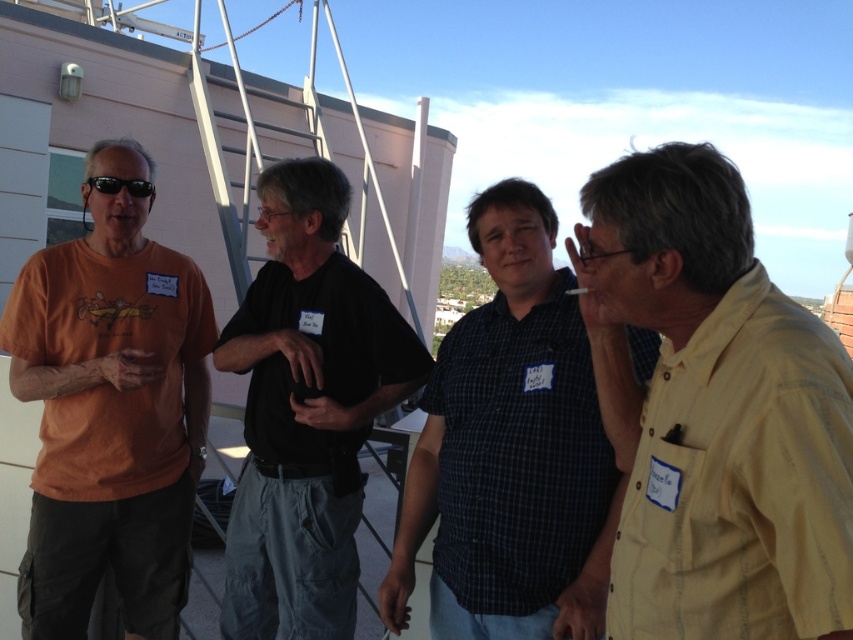
Question: Which of the following is the farthest from the observer?

Choices:
 (A) (144, 184)
 (B) (254, 432)
 (C) (492, 323)

Answer: (A)

Question: In this image, where is yellow cotton shirt at right located relative to black matte sunglasses at left?

Choices:
 (A) right
 (B) left

Answer: (A)

Question: From the image, what is the correct spatial relationship of matte orange t-shirt at left in relation to black matte sunglasses at left?

Choices:
 (A) below
 (B) above

Answer: (A)

Question: Among these objects, which one is farthest from the camera?

Choices:
 (A) black cotton shirt at center
 (B) black matte sunglasses at left

Answer: (B)

Question: Which point appears farthest from the camera in this image?

Choices:
 (A) pos(111,182)
 (B) pos(141,417)
 (C) pos(572,467)
 (D) pos(596,275)

Answer: (B)

Question: Does matte orange t-shirt at left have a smaller size compared to black matte sunglasses at left?

Choices:
 (A) yes
 (B) no

Answer: (B)